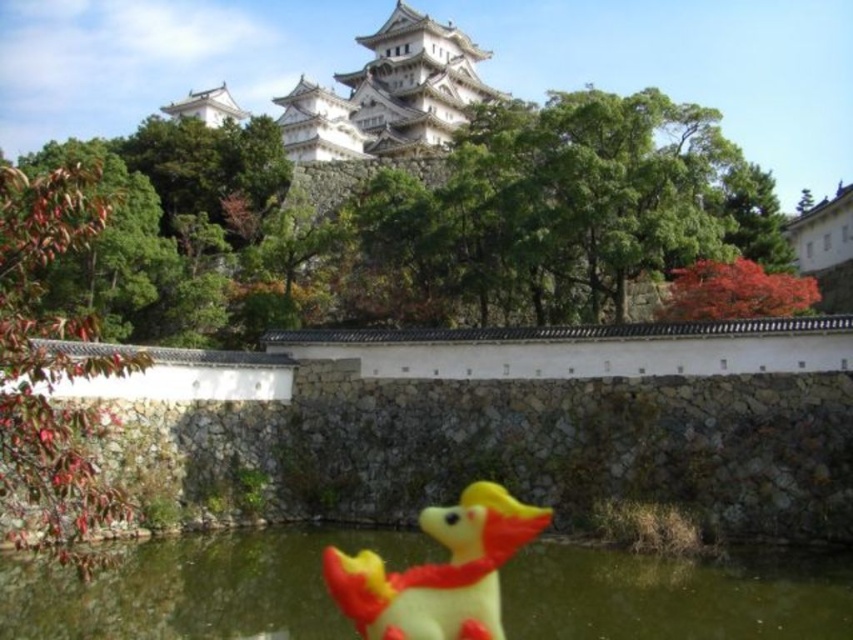
You are a visitor at the castle and want to take a photo of the yellow rubber duck at lower center without the translucent plastic water at center blocking the view. Is this possible?

The translucent plastic water at center is much taller than the yellow rubber duck at lower center, so it would block the view of the duck. Therefore, it is not possible to take a clear photo of the yellow rubber duck at lower center without the water obstructing it.

You are a tourist visiting the castle and want to take a photo of both the translucent plastic water at center and the yellow rubber duck at lower center. Based on their positions, which object should you focus on first to ensure both are in the frame?

You should focus on the yellow rubber duck at lower center first because the translucent plastic water at center is to the left of it, so positioning the duck in the center will keep both objects within the frame.